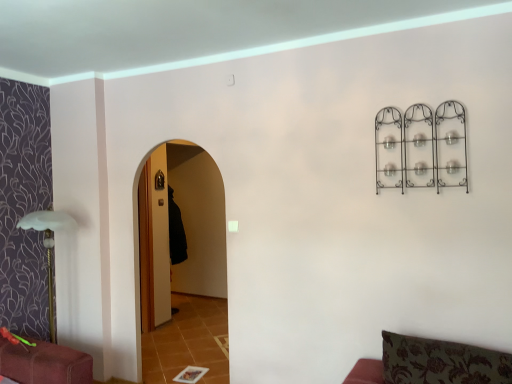
Question: Can you confirm if black fabric robe at center is bigger than green floral fabric cushion at lower right?

Choices:
 (A) no
 (B) yes

Answer: (A)

Question: Is black fabric robe at center outside of green floral fabric cushion at lower right?

Choices:
 (A) yes
 (B) no

Answer: (A)

Question: From the image's perspective, is black fabric robe at center located beneath green floral fabric cushion at lower right?

Choices:
 (A) yes
 (B) no

Answer: (B)

Question: Does black fabric robe at center turn towards green floral fabric cushion at lower right?

Choices:
 (A) yes
 (B) no

Answer: (B)

Question: From a real-world perspective, is black fabric robe at center located higher than green floral fabric cushion at lower right?

Choices:
 (A) yes
 (B) no

Answer: (A)

Question: Is black fabric robe at center taller than green floral fabric cushion at lower right?

Choices:
 (A) yes
 (B) no

Answer: (A)

Question: From the image's perspective, would you say green floral fabric cushion at lower right is positioned over black fabric robe at center?

Choices:
 (A) yes
 (B) no

Answer: (B)

Question: Can you confirm if green floral fabric cushion at lower right is thinner than black fabric robe at center?

Choices:
 (A) no
 (B) yes

Answer: (A)

Question: Is green floral fabric cushion at lower right surrounding black fabric robe at center?

Choices:
 (A) yes
 (B) no

Answer: (B)

Question: Can you confirm if green floral fabric cushion at lower right is bigger than black fabric robe at center?

Choices:
 (A) no
 (B) yes

Answer: (B)

Question: Is green floral fabric cushion at lower right to the right of black fabric robe at center from the viewer's perspective?

Choices:
 (A) yes
 (B) no

Answer: (A)

Question: From a real-world perspective, is green floral fabric cushion at lower right below black fabric robe at center?

Choices:
 (A) no
 (B) yes

Answer: (B)

Question: Would you say green floral fabric cushion at lower right is inside or outside black fabric robe at center?

Choices:
 (A) inside
 (B) outside

Answer: (B)